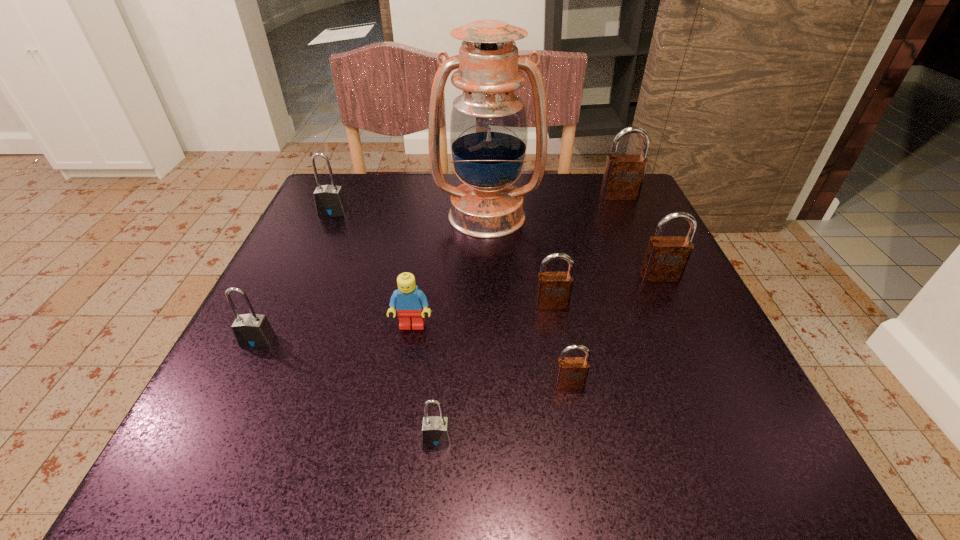
The height and width of the screenshot is (540, 960). I want to click on free spot located on the front-facing side of the third nearest brown padlock, so click(x=680, y=319).

Identify the location of vacant space located 0.120m on the shackle of the fifth farthest padlock. [222, 411].

Find the location of a particular element. This screenshot has height=540, width=960. vacant space located 0.180m on the front-facing side of the fifth farthest object is located at coordinates (567, 394).

In order to click on vacant space located on the face of the Lego in this screenshot , I will do `click(392, 455)`.

Identify the location of free space located on the front-facing side of the sixth farthest padlock. This screenshot has height=540, width=960. (576, 418).

Locate an element on the screen. The image size is (960, 540). oil lamp situated at the far edge is located at coordinates (489, 126).

This screenshot has width=960, height=540. In order to click on object that is at the near edge in this screenshot , I will do `click(436, 431)`.

You are a GUI agent. You are given a task and a screenshot of the screen. Output one action in this format:
    pyautogui.click(x=<x>, y=<y>)
    Task: Click on the object that is positioned at the far left corner
    The width and height of the screenshot is (960, 540).
    Given the screenshot: What is the action you would take?
    pyautogui.click(x=329, y=200)

Locate an element on the screen. The width and height of the screenshot is (960, 540). object that is at the far right corner is located at coordinates (623, 177).

Find the location of a particular element. This screenshot has width=960, height=540. vacant space at the far edge of the desktop is located at coordinates [x=382, y=222].